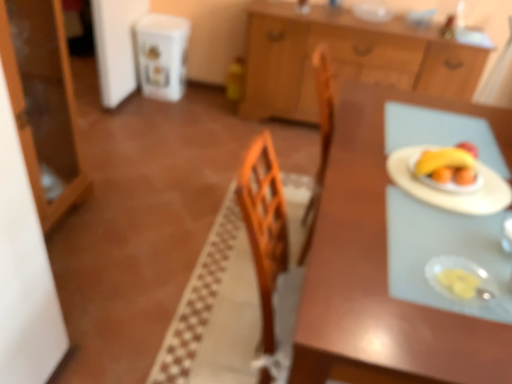
Identify the location of free area in between white paper plate at right and translucent plastic plate at right, the first tableware when ordered from left to right. (443, 235).